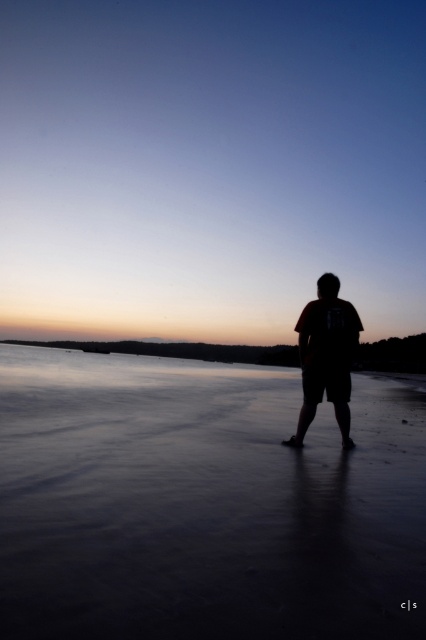
Question: Is smooth sand at center bigger than silhouette t-shirt at center?

Choices:
 (A) no
 (B) yes

Answer: (B)

Question: Is smooth sand at center to the left of silhouette t-shirt at center from the viewer's perspective?

Choices:
 (A) yes
 (B) no

Answer: (A)

Question: Which point appears farthest from the camera in this image?

Choices:
 (A) (350, 342)
 (B) (152, 412)

Answer: (B)

Question: Can you confirm if smooth sand at center is smaller than silhouette t-shirt at center?

Choices:
 (A) yes
 (B) no

Answer: (B)

Question: Which of the following is the closest to the observer?

Choices:
 (A) smooth sand at center
 (B) silhouette t-shirt at center

Answer: (A)